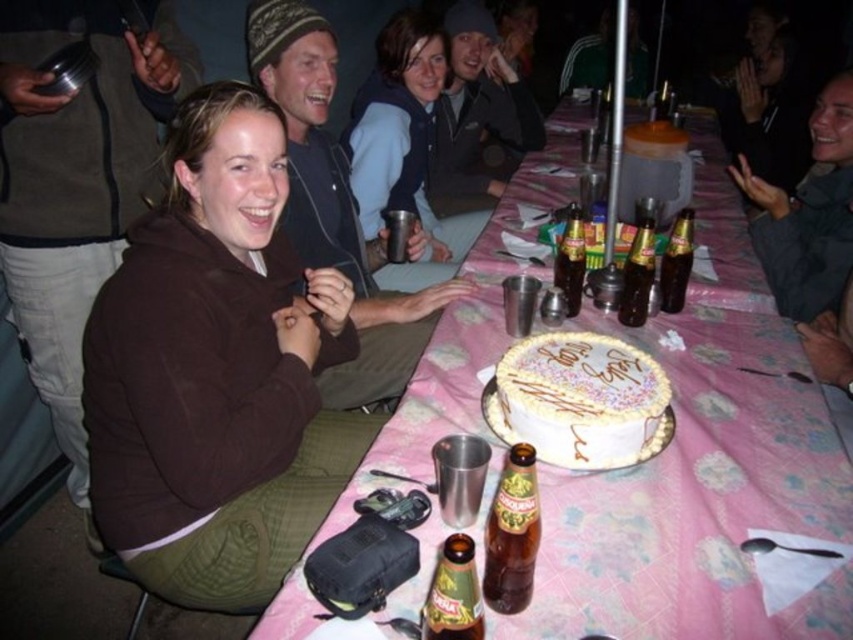
Question: Which point is closer to the camera?

Choices:
 (A) (564, 273)
 (B) (531, 451)

Answer: (B)

Question: Is pink floral tablecloth at center wider than translucent glass bottle at center?

Choices:
 (A) yes
 (B) no

Answer: (A)

Question: From the image, what is the correct spatial relationship of white frosted cake at center in relation to brown glass bottle at lower center?

Choices:
 (A) left
 (B) right

Answer: (B)

Question: Estimate the real-world distances between objects in this image. Which object is farther from the green glass bottle at center?

Choices:
 (A) brown fleece at left
 (B) gold glass beer bottle at center
 (C) translucent glass bottle at center

Answer: (C)

Question: Does brown glass bottle at lower center have a greater width compared to green glass bottle at center?

Choices:
 (A) no
 (B) yes

Answer: (A)

Question: Estimate the real-world distances between objects in this image. Which object is farther from the white frosted cake at center?

Choices:
 (A) matte blue jacket at center
 (B) brown fleece at left

Answer: (A)